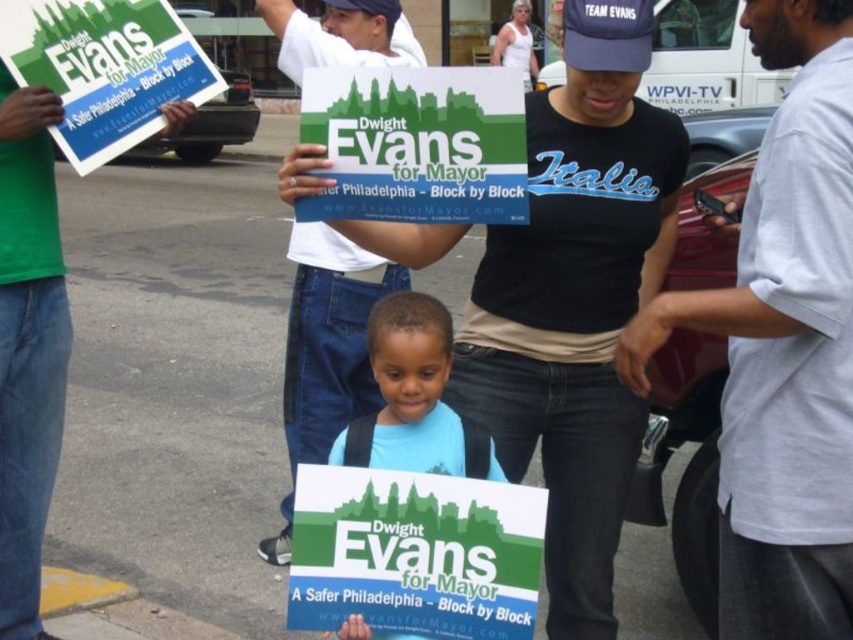
Can you confirm if blue matte shirt at center is positioned to the right of navy blue fabric baseball cap at upper center?

Incorrect, blue matte shirt at center is not on the right side of navy blue fabric baseball cap at upper center.

Does blue matte shirt at center appear over navy blue fabric baseball cap at upper center?

No.

Where is `blue matte shirt at center`? Image resolution: width=853 pixels, height=640 pixels. blue matte shirt at center is located at coordinates (413, 397).

Is matte plastic sign at center positioned in front of white cotton t-shirt at center?

Yes, matte plastic sign at center is in front of white cotton t-shirt at center.

Is matte plastic sign at center bigger than white cotton t-shirt at center?

No.

The image size is (853, 640). I want to click on matte plastic sign at center, so click(416, 145).

Consider the image. Can you confirm if white cotton t-shirt at center is positioned to the left of blue matte shirt at center?

Correct, you'll find white cotton t-shirt at center to the left of blue matte shirt at center.

Consider the image. Can you confirm if white cotton t-shirt at center is positioned to the right of blue matte shirt at center?

Incorrect, white cotton t-shirt at center is not on the right side of blue matte shirt at center.

Does point (283, 406) come closer to viewer compared to point (398, 410)?

No, (283, 406) is further to viewer.

You are a GUI agent. You are given a task and a screenshot of the screen. Output one action in this format:
    pyautogui.click(x=<x>, y=<y>)
    Task: Click on the white cotton t-shirt at center
    
    Given the screenshot: What is the action you would take?
    pyautogui.click(x=329, y=337)